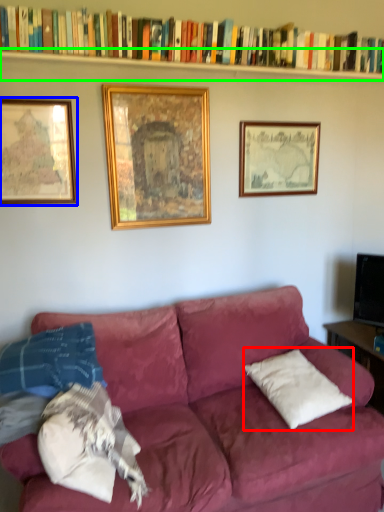
Question: Which object is the farthest from pillow (highlighted by a red box)? Choose among these: picture frame (highlighted by a blue box) or shelf (highlighted by a green box).

Choices:
 (A) picture frame
 (B) shelf

Answer: (B)